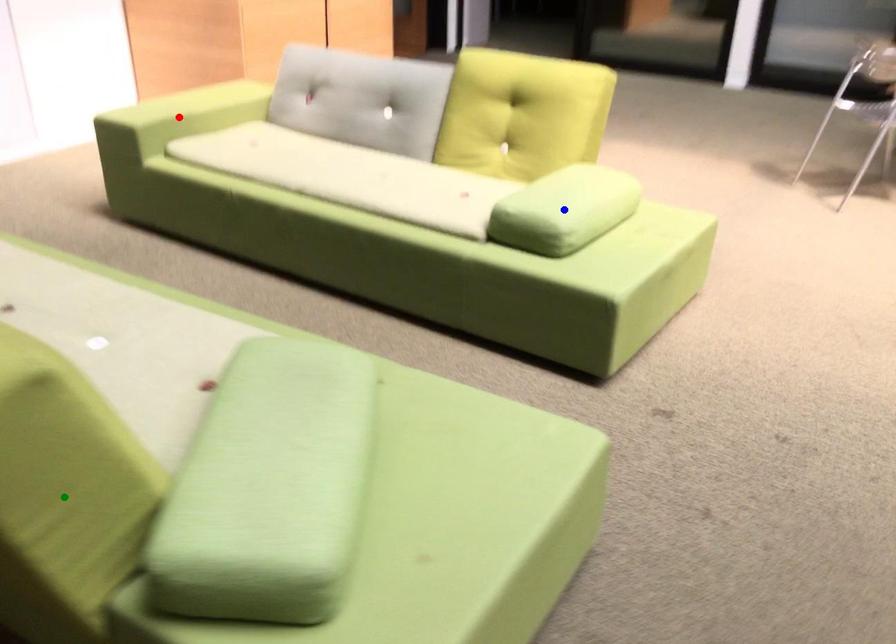
Order these from nearest to farthest:
green point, red point, blue point

green point < blue point < red point